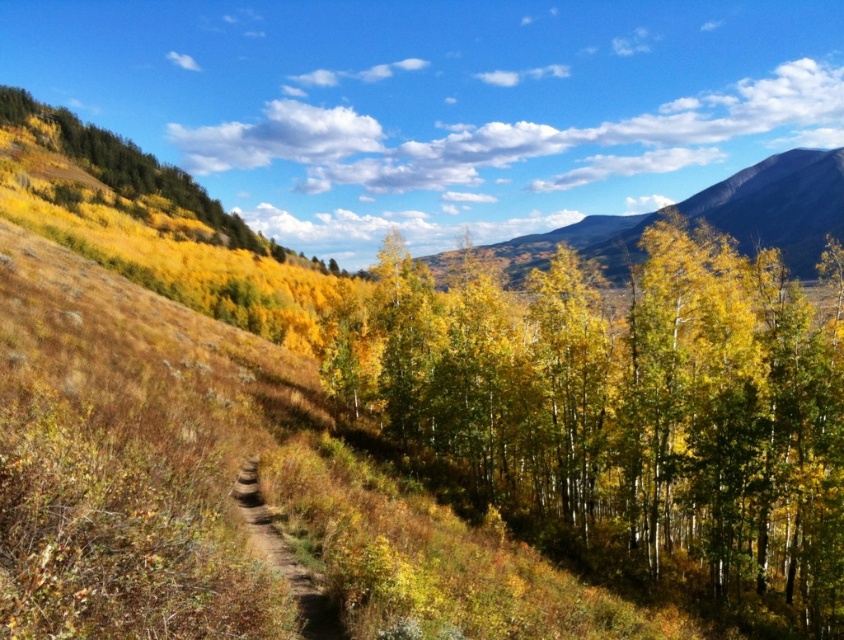
Does yellow-green leaves at center lie in front of brown dirt path at center?

No, it is behind brown dirt path at center.

In the scene shown: Who is more forward, (521, 445) or (303, 637)?

Point (303, 637) is more forward.

Describe the element at coordinates (623, 410) in the screenshot. The image size is (844, 640). I see `yellow-green leaves at center` at that location.

At what (x,y) coordinates should I click in order to perform the action: click on yellow-green leaves at center. Please return your answer as a coordinate pair (x, y). The width and height of the screenshot is (844, 640). Looking at the image, I should click on (623, 410).